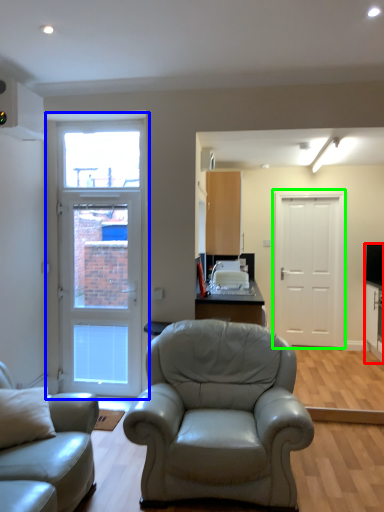
Question: Which object is positioned closest to entertainment center (highlighted by a red box)? Select from door (highlighted by a blue box) and door (highlighted by a green box).

Choices:
 (A) door
 (B) door

Answer: (B)